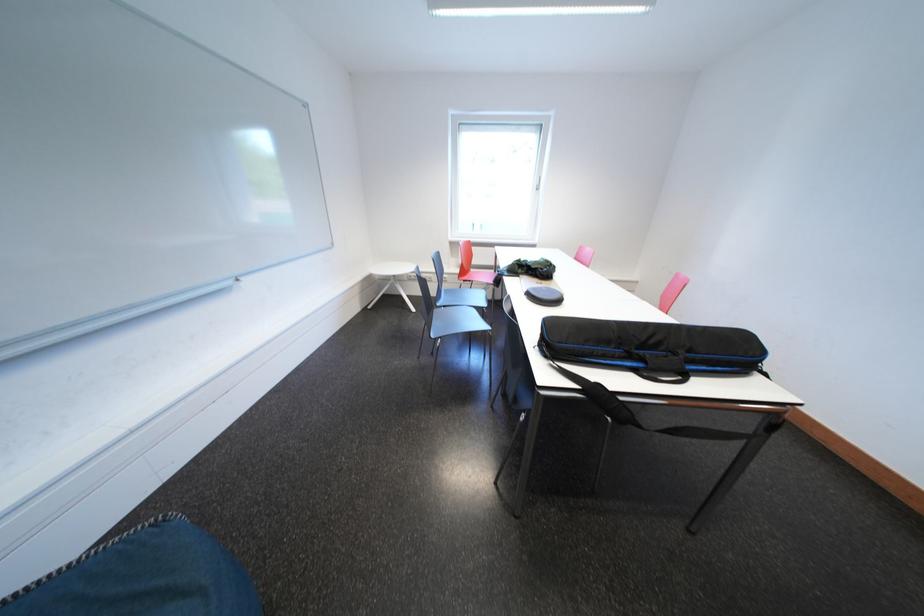
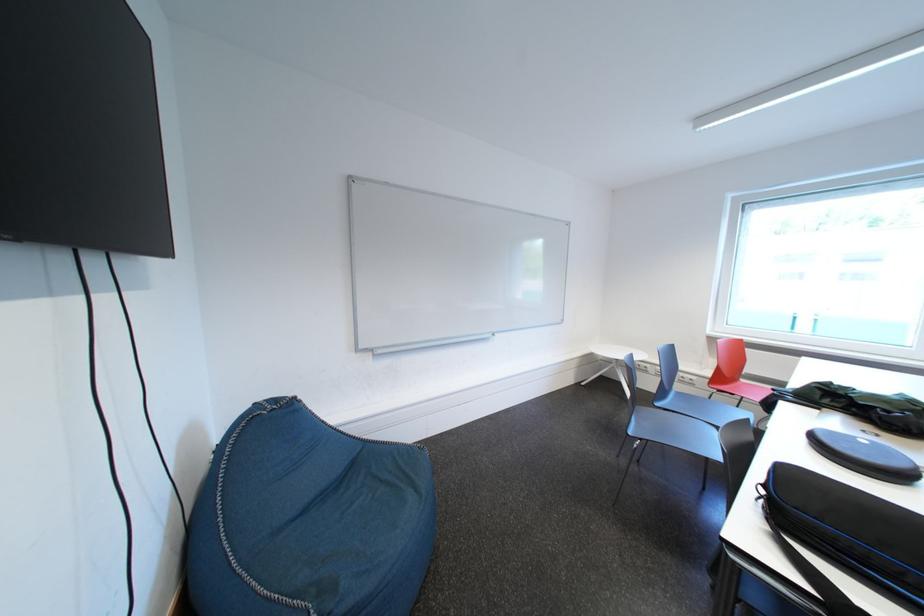
Where in the second image is the point corresponding to point 442,341 from the first image?

(639, 437)